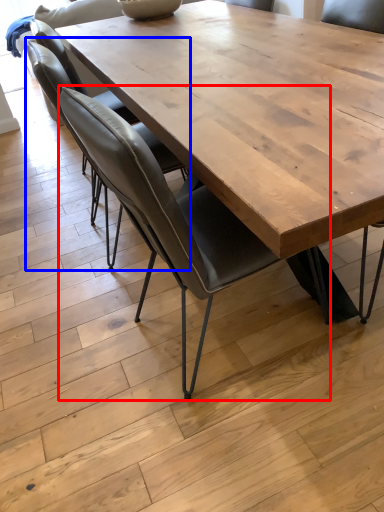
Question: Which point is closer to the camera, chair (highlighted by a red box) or chair (highlighted by a blue box)?

Choices:
 (A) chair
 (B) chair

Answer: (A)